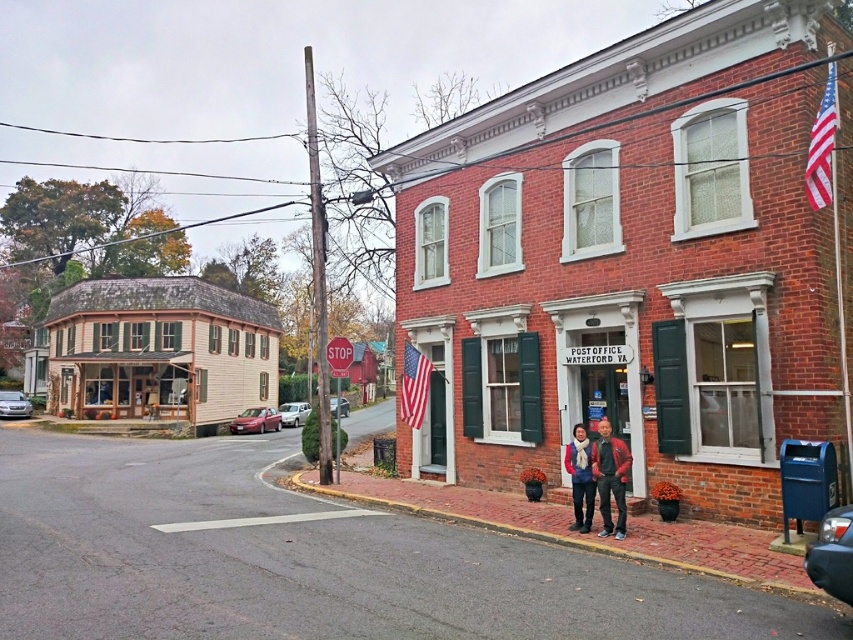
Question: Which of the following is the closest to the observer?

Choices:
 (A) light beige wood siding at left
 (B) red leather jacket at center
 (C) red metal stop sign at center
 (D) red fabric flag at upper right

Answer: (D)

Question: Observing the image, what is the correct spatial positioning of red fabric flag at upper right in reference to matte blue scarf at center?

Choices:
 (A) below
 (B) above

Answer: (B)

Question: Is light beige wood siding at left bigger than red metal stop sign at center?

Choices:
 (A) yes
 (B) no

Answer: (A)

Question: Which point appears farthest from the camera in this image?

Choices:
 (A) pyautogui.click(x=817, y=202)
 (B) pyautogui.click(x=418, y=406)
 (C) pyautogui.click(x=579, y=448)

Answer: (B)

Question: Can you confirm if american flag at center is wider than red metal stop sign at center?

Choices:
 (A) no
 (B) yes

Answer: (A)

Question: Which object is the closest to the american flag at center?

Choices:
 (A) light beige wood siding at left
 (B) matte blue scarf at center
 (C) red fabric flag at upper right

Answer: (B)